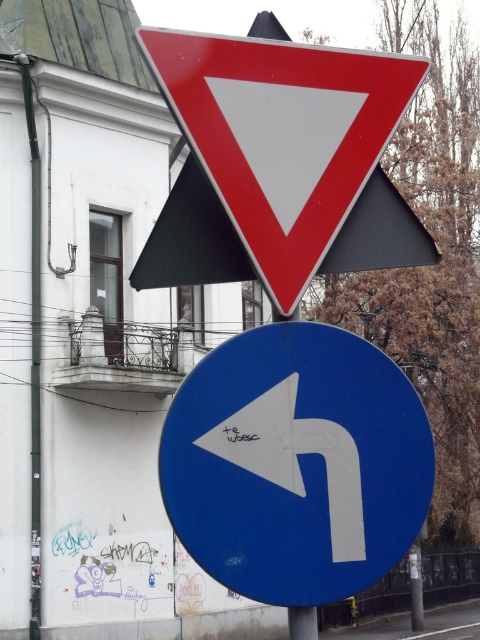
Can you confirm if blue glossy arrow at center is positioned to the right of white matte arrow at center?

In fact, blue glossy arrow at center is to the left of white matte arrow at center.

Does point (286, 403) come behind point (269, 458)?

Yes, point (286, 403) is behind point (269, 458).

Find the location of `blue glossy arrow at center`. blue glossy arrow at center is located at coordinates (296, 464).

Can you confirm if metallic red triangle at upper center is positioned below white matte arrow at center?

Actually, metallic red triangle at upper center is above white matte arrow at center.

Is metallic red triangle at upper center positioned behind white matte arrow at center?

That is False.

Where is `metallic red triangle at upper center`? metallic red triangle at upper center is located at coordinates (284, 161).

Does blue glossy arrow at center have a larger size compared to metallic red triangle at upper center?

Actually, blue glossy arrow at center might be smaller than metallic red triangle at upper center.

Who is lower down, blue glossy arrow at center or metallic red triangle at upper center?

Positioned lower is blue glossy arrow at center.

Is point (416, 424) positioned behind point (311, 275)?

No.

Locate an element on the screen. This screenshot has height=640, width=480. blue glossy arrow at center is located at coordinates (296, 464).